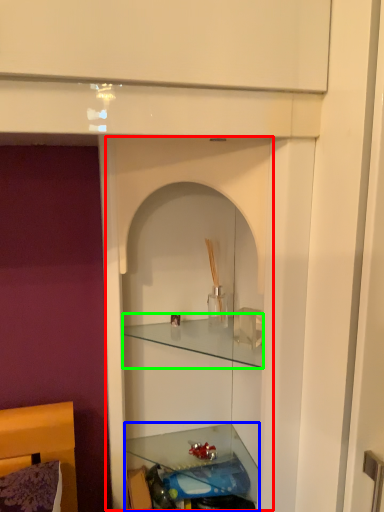
Question: Based on their relative distances, which object is farther from cabinet (highlighted by a red box)? Choose from shelf (highlighted by a blue box) and cabinet (highlighted by a green box).

Choices:
 (A) shelf
 (B) cabinet

Answer: (A)